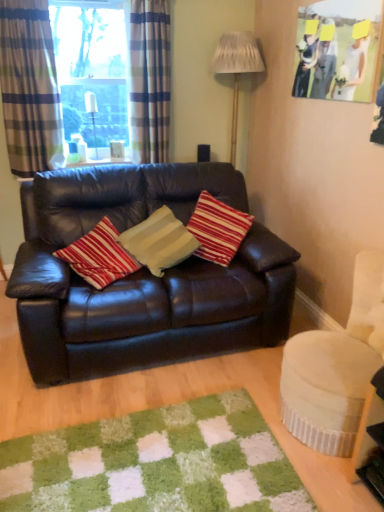
I want to click on vacant area on the back side of green shaggy mat at lower center, so click(159, 383).